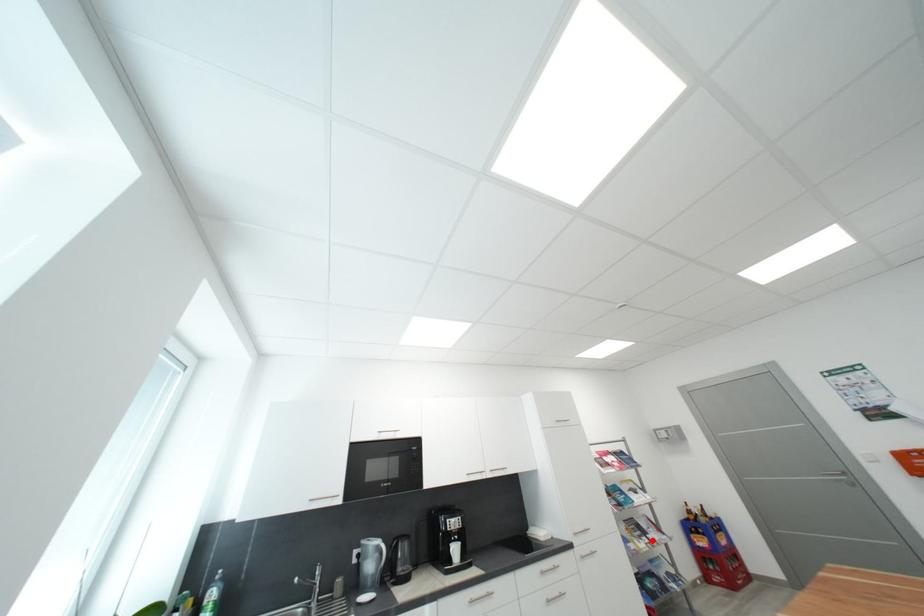
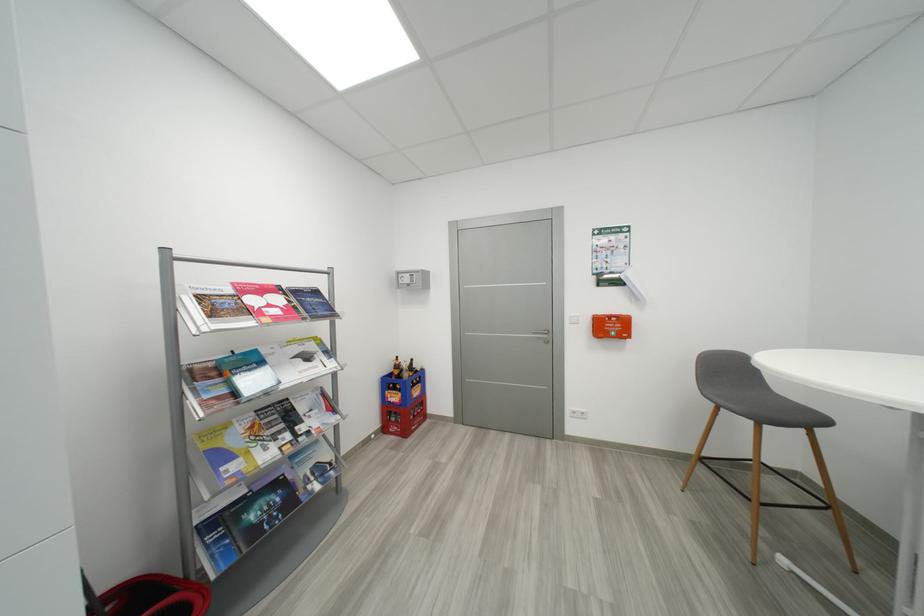
The point at the highlighted location is marked in the first image. Where is the corresponding point in the second image?

(294, 438)